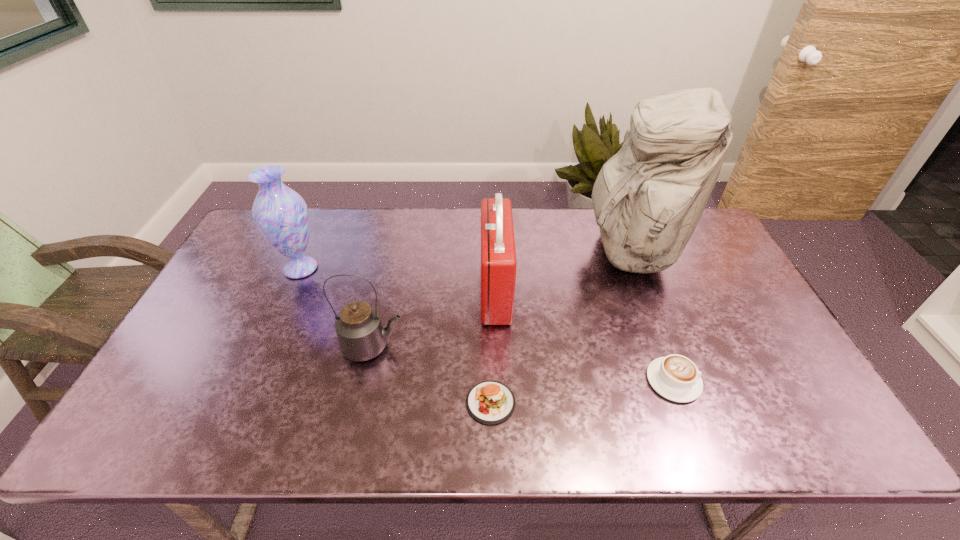
At what (x,y) coordinates should I click in order to perform the action: click on blank area in the image that satisfies the following two spatial constraints: 1. spout on the patty (food); 2. on the right side of the kettle. Please return your answer as a coordinate pair (x, y). This screenshot has height=540, width=960. Looking at the image, I should click on (361, 402).

Locate an element on the screen. blank area in the image that satisfies the following two spatial constraints: 1. on the back side of the patty (food); 2. spout on the kettle is located at coordinates (490, 347).

Identify the location of vacant area in the image that satisfies the following two spatial constraints: 1. on the front face of the first-aid kit; 2. on the front side of the patty (food). The image size is (960, 540). (499, 402).